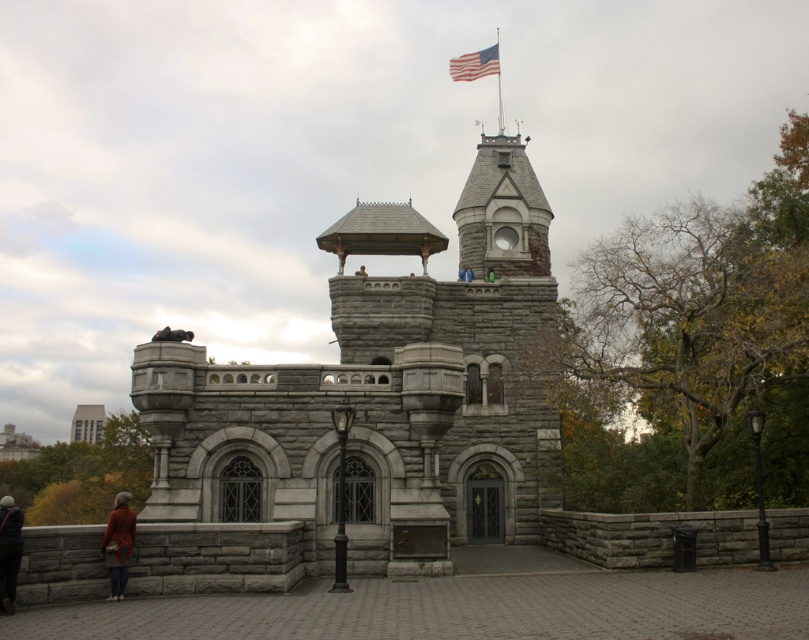
Does point (121, 532) come farther from viewer compared to point (102, 417)?

No, it is not.

Which is above, orange sweater at lower left or gray stone tower at lower left?

Positioned higher is orange sweater at lower left.

Which is behind, point (106, 547) or point (87, 433)?

Positioned behind is point (87, 433).

Where is `orange sweater at lower left`? orange sweater at lower left is located at coordinates (117, 541).

Is the position of gray stone castle at center less distant than that of orange sweater at lower left?

No, gray stone castle at center is behind orange sweater at lower left.

Does gray stone castle at center lie behind orange sweater at lower left?

That is True.

Measure the distance between gray stone castle at center and camera.

They are 61.31 meters apart.

What are the coordinates of `gray stone castle at center` in the screenshot? It's located at (380, 394).

This screenshot has width=809, height=640. Describe the element at coordinates (380, 394) in the screenshot. I see `gray stone castle at center` at that location.

Between point (422, 480) and point (13, 586), which one is positioned in front?

Positioned in front is point (13, 586).

You are a GUI agent. You are given a task and a screenshot of the screen. Output one action in this format:
    pyautogui.click(x=<x>, y=<y>)
    Task: Click on the gray stone castle at center
    
    Given the screenshot: What is the action you would take?
    pyautogui.click(x=380, y=394)